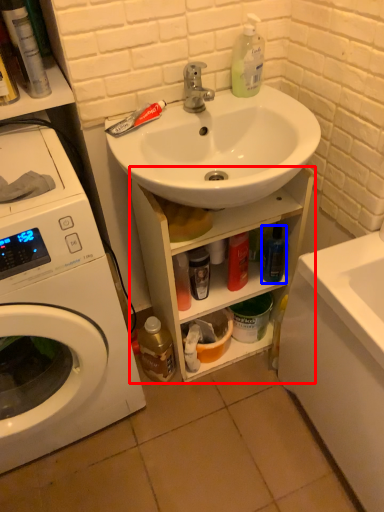
Question: Which of the following is the farthest to the observer, bathroom cabinet (highlighted by a red box) or bottle (highlighted by a blue box)?

Choices:
 (A) bathroom cabinet
 (B) bottle

Answer: (B)